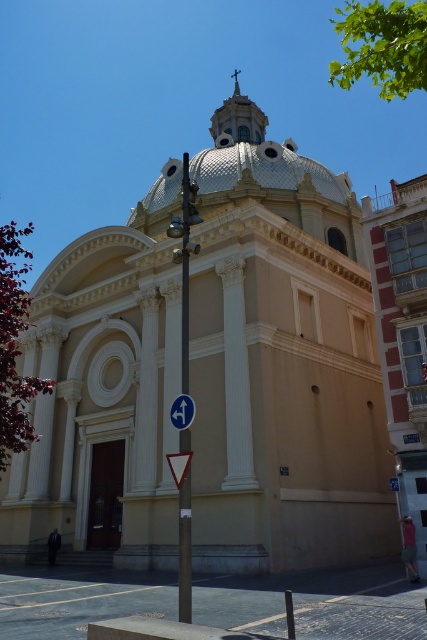
Between metallic pole at center and white plastic arrow at center, which one is positioned lower?

Positioned lower is white plastic arrow at center.

Can you confirm if metallic pole at center is positioned above white plastic arrow at center?

Yes.

The image size is (427, 640). What are the coordinates of `metallic pole at center` in the screenshot? It's located at pos(186,266).

Does white plastic arrow at center have a lesser width compared to white plastic triangle at center?

Yes, white plastic arrow at center is thinner than white plastic triangle at center.

Which is behind, point (190, 417) or point (186, 456)?

Positioned behind is point (190, 417).

Is point (181, 417) farther from viewer compared to point (172, 467)?

Yes.

In order to click on white plastic arrow at center in this screenshot , I will do `click(181, 412)`.

Is metallic pole at center closer to the viewer compared to white plastic triangle at center?

Yes, it is.

Between metallic pole at center and white plastic triangle at center, which one appears on the left side from the viewer's perspective?

From the viewer's perspective, metallic pole at center appears more on the left side.

Does point (181, 586) come in front of point (172, 456)?

Yes, point (181, 586) is closer to viewer.

You are a GUI agent. You are given a task and a screenshot of the screen. Output one action in this format:
    pyautogui.click(x=<x>, y=<y>)
    Task: Click on the metallic pole at center
    The image size is (427, 640).
    Given the screenshot: What is the action you would take?
    pyautogui.click(x=186, y=266)